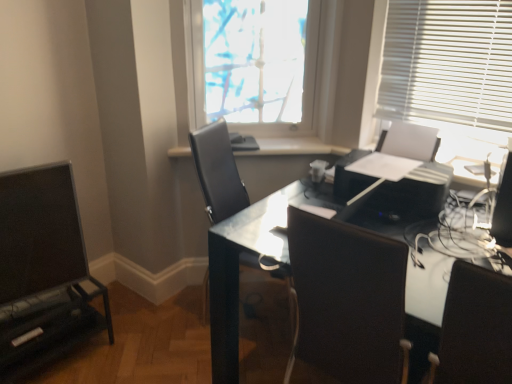
Question: Is black plastic printer at center to the left or to the right of white glossy window sill at center in the image?

Choices:
 (A) left
 (B) right

Answer: (B)

Question: Would you say black plastic printer at center is inside or outside white glossy window sill at center?

Choices:
 (A) outside
 (B) inside

Answer: (A)

Question: Estimate the real-world distances between objects in this image. Which object is farther from the white glossy window sill at center?

Choices:
 (A) translucent fabric at upper center
 (B) matte black entertainment center at left
 (C) black plastic printer at center
 (D) black leather chair at center, the second chair viewed from the front
 (E) glossy black desk at center

Answer: (B)

Question: Which object is positioned farthest from the glossy black desk at center?

Choices:
 (A) black plastic printer at center
 (B) translucent fabric at upper center
 (C) matte black entertainment center at left
 (D) white glossy window sill at center
 (E) black leather chair at right, positioned as the 2th chair in left-to-right order

Answer: (C)